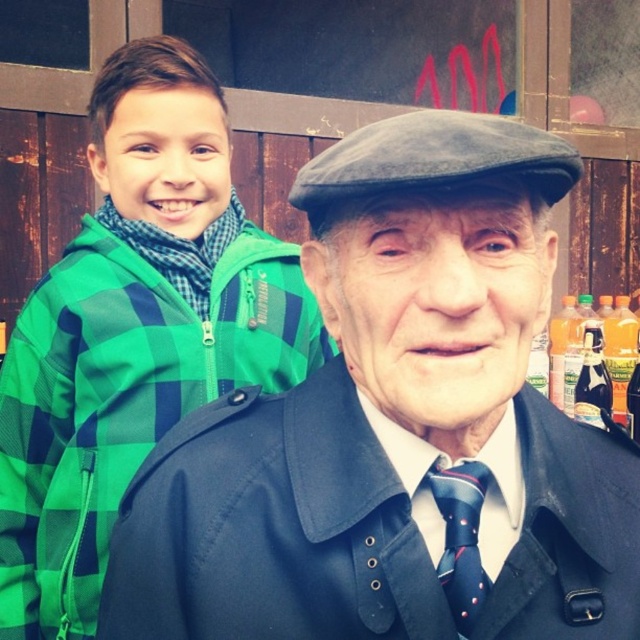
You are a photographer setting up a photo shoot. You want to place a new prop at a position that is directly between the two people in the image. Given that the coordinates of the matte black coat at center are at point 0.662, 0.617, can you determine if placing the prop there would be appropriate?

The matte black coat at center is located at point (394, 422), so placing the prop there would not be appropriate since the coordinates indicate the position of the matte black coat at center, which is already occupied by an object.

You are a photographer trying to focus on the matte black coat at center and the dark blue silk tie at center. Since you can only focus on one object at a time, which one should you choose to ensure it fills more of your camera frame?

The matte black coat at center is bigger than the dark blue silk tie at center, so you should focus on the matte black coat at center to ensure it fills more of your camera frame.

You are a photographer trying to adjust the lighting for a photo of the two people in the image. You need to ensure that the green checkered jacket at left is well lit. Where should you place the light source relative to the camera to achieve this?

To ensure the green checkered jacket at left is well lit, place the light source to the left side of the camera, as the green checkered jacket at left is positioned at point (134, 330), which is on the left side of the frame.